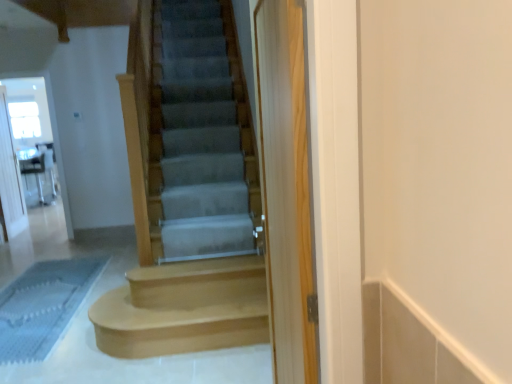
Question: From the image's perspective, is light brown wood stairs at center, the first stairs when ordered from bottom to top, beneath clear glass screen door at upper left, acting as the second screen door starting from the right?

Choices:
 (A) yes
 (B) no

Answer: (A)

Question: Does light brown wood stairs at center, the first stairs when ordered from bottom to top, touch clear glass screen door at upper left, the 2th screen door from the left?

Choices:
 (A) no
 (B) yes

Answer: (A)

Question: Is light brown wood stairs at center, which is counted as the second stairs, starting from the top, closer to the viewer compared to clear glass screen door at upper left, the second screen door viewed from the front?

Choices:
 (A) yes
 (B) no

Answer: (A)

Question: Considering the relative sizes of light brown wood stairs at center, the first stairs when ordered from bottom to top, and clear glass screen door at upper left, acting as the second screen door starting from the right, in the image provided, is light brown wood stairs at center, the first stairs when ordered from bottom to top, bigger than clear glass screen door at upper left, acting as the second screen door starting from the right,?

Choices:
 (A) no
 (B) yes

Answer: (B)

Question: Is there a large distance between light brown wood stairs at center, which appears as the first stairs when viewed from the back, and clear glass screen door at upper left, the second screen door when ordered from back to front?

Choices:
 (A) no
 (B) yes

Answer: (B)

Question: Is point (9, 236) positioned closer to the camera than point (161, 172)?

Choices:
 (A) closer
 (B) farther

Answer: (B)

Question: From the image's perspective, is clear glass screen door at left, acting as the 3th screen door starting from the front, above or below smooth gray carpet at center, which appears as the 2th stairs when viewed from the back?

Choices:
 (A) below
 (B) above

Answer: (B)

Question: Considering the positions of clear glass screen door at left, acting as the 3th screen door starting from the front, and smooth gray carpet at center, which appears as the 1th stairs when viewed from the top, in the image, is clear glass screen door at left, acting as the 3th screen door starting from the front, bigger or smaller than smooth gray carpet at center, which appears as the 1th stairs when viewed from the top,?

Choices:
 (A) small
 (B) big

Answer: (B)

Question: From a real-world perspective, is clear glass screen door at left, the third screen door from the right, above or below smooth gray carpet at center, which appears as the 2th stairs when viewed from the back?

Choices:
 (A) above
 (B) below

Answer: (B)

Question: Is light brown wood stairs at center, which appears as the first stairs when viewed from the back, bigger or smaller than smooth gray carpet at center, positioned as the second stairs in bottom-to-top order?

Choices:
 (A) big
 (B) small

Answer: (A)

Question: From a real-world perspective, is light brown wood stairs at center, the first stairs when ordered from bottom to top, positioned above or below smooth gray carpet at center, positioned as the second stairs in bottom-to-top order?

Choices:
 (A) below
 (B) above

Answer: (A)

Question: Is point (138, 283) positioned closer to the camera than point (179, 220)?

Choices:
 (A) farther
 (B) closer

Answer: (B)

Question: Considering their positions, is light brown wood stairs at center, the first stairs when ordered from bottom to top, located in front of or behind smooth gray carpet at center, which appears as the 1th stairs when viewed from the top?

Choices:
 (A) front
 (B) behind

Answer: (B)

Question: From the image's perspective, relative to clear glass screen door at left, the 1th screen door from the back, is light brown wood stairs at center, which appears as the first stairs when viewed from the back, above or below?

Choices:
 (A) above
 (B) below

Answer: (B)

Question: From a real-world perspective, is light brown wood stairs at center, the first stairs when ordered from bottom to top, physically located above or below clear glass screen door at left, the 1th screen door from the back?

Choices:
 (A) above
 (B) below

Answer: (B)